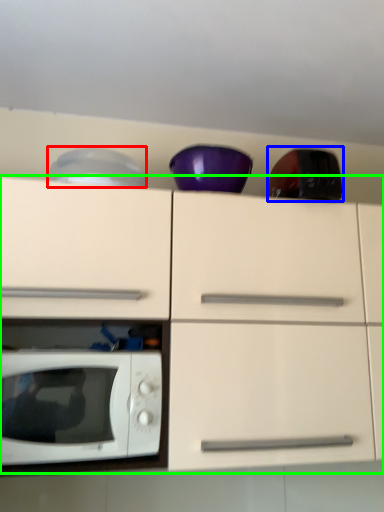
Question: Which object is the closest to the appliance (highlighted by a red box)? Choose among these: appliance (highlighted by a blue box) or cabinetry (highlighted by a green box).

Choices:
 (A) appliance
 (B) cabinetry

Answer: (B)